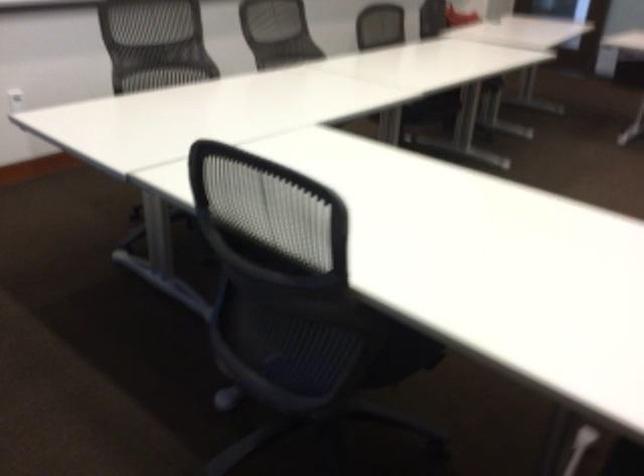
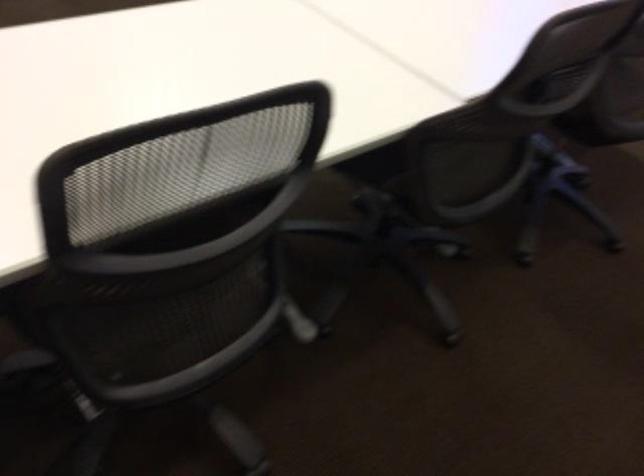
Question: In a continuous first-person perspective shot, in which direction is the camera moving?

Choices:
 (A) Left
 (B) Right
 (C) Forward
 (D) Backward

Answer: (D)